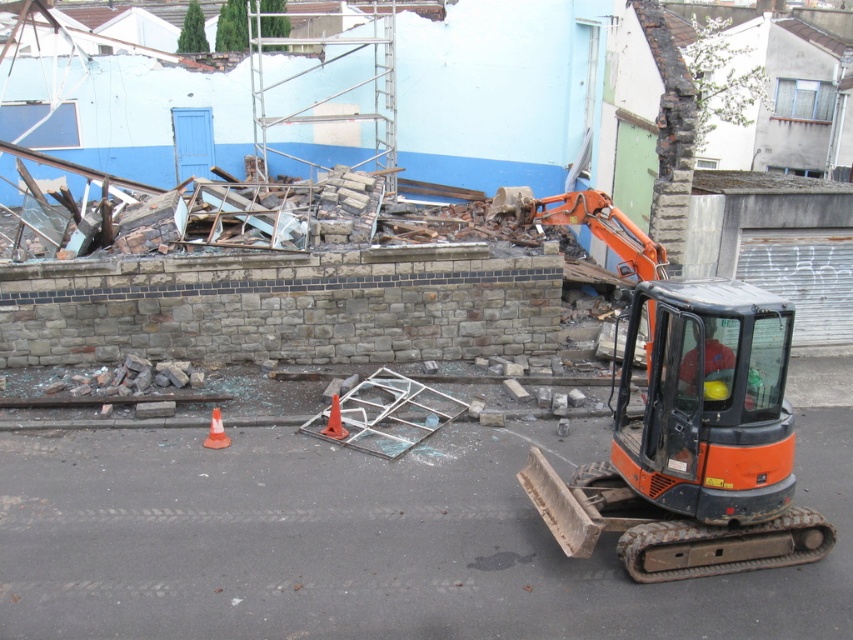
Does orange hard hat at center have a greater width compared to orange plastic cone at center?

Yes, orange hard hat at center is wider than orange plastic cone at center.

Who is more forward, (706, 323) or (328, 416)?

Positioned in front is point (706, 323).

Between point (706, 400) and point (338, 433), which one is positioned in front?

Point (706, 400) is in front.

This screenshot has height=640, width=853. I want to click on orange hard hat at center, so click(718, 358).

Between orange metallic excavator at center and orange plastic cone at center, which one is positioned higher?

orange metallic excavator at center is above.

Is point (645, 332) positioned behind point (334, 412)?

No, (645, 332) is closer to viewer.

In order to click on orange metallic excavator at center in this screenshot , I will do `click(682, 420)`.

Does orange metallic excavator at center have a lesser height compared to orange hard hat at center?

Incorrect, orange metallic excavator at center's height does not fall short of orange hard hat at center's.

Which is behind, point (643, 280) or point (730, 376)?

Point (643, 280)

Identify the location of orange metallic excavator at center. The width and height of the screenshot is (853, 640). (682, 420).